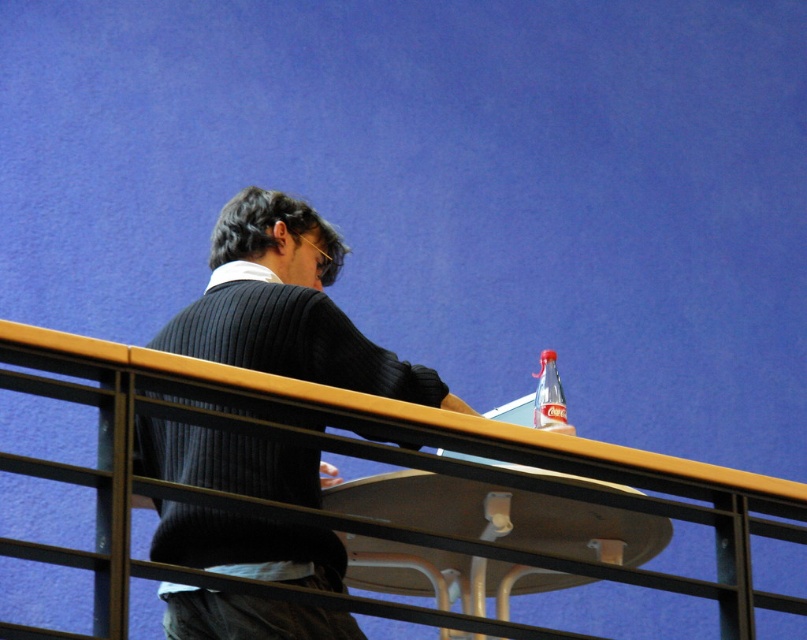
You are a delivery person who needs to place a new item on the table. The table has the ribbed sweater at center and the translucent plastic bottle at upper right. Can you fit a 10cm wide box between them?

The ribbed sweater at center is bigger than the translucent plastic bottle at upper right. However, without knowing the exact sizes and spacing between them, it is impossible to determine if a 10cm wide box can fit between them.

You are standing in a room and see a yellow wood rail at upper center and a translucent plastic bottle at upper right. Which object is positioned to the left when viewed from the front?

The yellow wood rail at upper center is positioned to the left of the translucent plastic bottle at upper right.